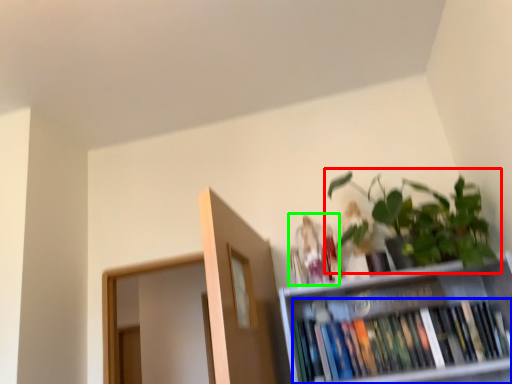
Question: Which object is positioned farthest from houseplant (highlighted by a red box)? Select from book (highlighted by a blue box) and toy (highlighted by a green box).

Choices:
 (A) book
 (B) toy

Answer: (A)